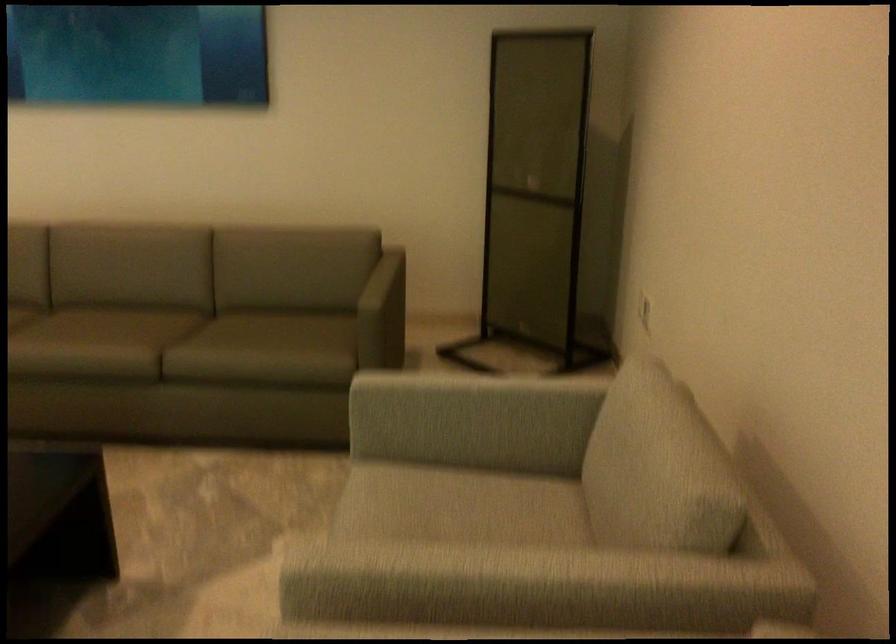
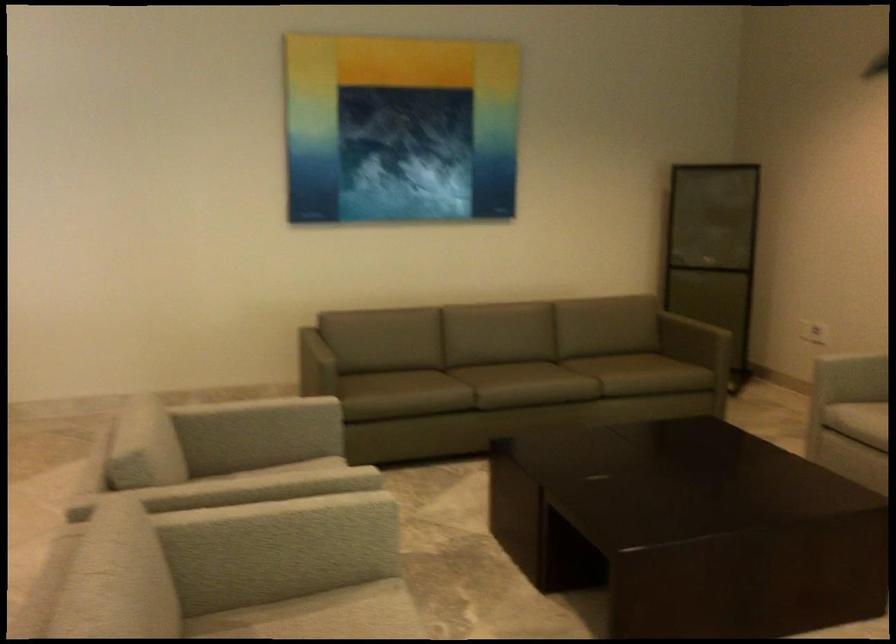
In the second image, find the point that corresponds to point 393,521 in the first image.

(857, 420)